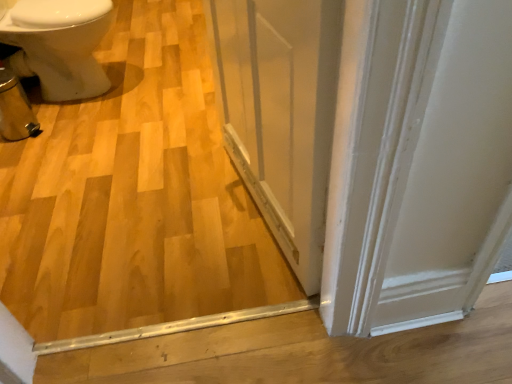
Question: Should I look upward or downward to see natural wood floor at center?

Choices:
 (A) down
 (B) up

Answer: (B)

Question: Considering the relative sizes of natural wood floor at center and transparent glass screen door at center in the image provided, is natural wood floor at center taller than transparent glass screen door at center?

Choices:
 (A) no
 (B) yes

Answer: (A)

Question: Is natural wood floor at center surrounding transparent glass screen door at center?

Choices:
 (A) no
 (B) yes

Answer: (A)

Question: From a real-world perspective, is natural wood floor at center under transparent glass screen door at center?

Choices:
 (A) no
 (B) yes

Answer: (B)

Question: From the image's perspective, is natural wood floor at center beneath transparent glass screen door at center?

Choices:
 (A) no
 (B) yes

Answer: (A)

Question: From a real-world perspective, is natural wood floor at center located higher than transparent glass screen door at center?

Choices:
 (A) no
 (B) yes

Answer: (A)

Question: Is natural wood floor at center to the right of transparent glass screen door at center from the viewer's perspective?

Choices:
 (A) yes
 (B) no

Answer: (B)

Question: Is natural wood floor at center facing towards white glossy bidet at left?

Choices:
 (A) yes
 (B) no

Answer: (A)

Question: Does natural wood floor at center have a greater height compared to white glossy bidet at left?

Choices:
 (A) no
 (B) yes

Answer: (A)

Question: Considering the relative sizes of natural wood floor at center and white glossy bidet at left in the image provided, is natural wood floor at center bigger than white glossy bidet at left?

Choices:
 (A) yes
 (B) no

Answer: (A)

Question: Is natural wood floor at center at the left side of white glossy bidet at left?

Choices:
 (A) yes
 (B) no

Answer: (B)

Question: Considering the relative positions of natural wood floor at center and white glossy bidet at left in the image provided, is natural wood floor at center to the right of white glossy bidet at left from the viewer's perspective?

Choices:
 (A) yes
 (B) no

Answer: (A)

Question: From a real-world perspective, is natural wood floor at center positioned under white glossy bidet at left based on gravity?

Choices:
 (A) yes
 (B) no

Answer: (A)

Question: Considering the relative sizes of white glossy bidet at left and transparent glass screen door at center in the image provided, is white glossy bidet at left bigger than transparent glass screen door at center?

Choices:
 (A) yes
 (B) no

Answer: (A)